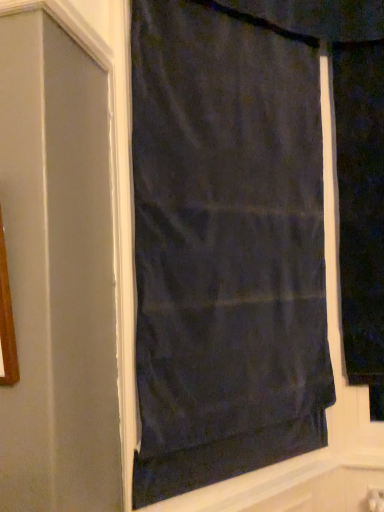
At what (x,y) coordinates should I click in order to perform the action: click on black fabric curtain at right, which is counted as the 1th curtain, starting from the right. Please return your answer as a coordinate pair (x, y). This screenshot has height=512, width=384. Looking at the image, I should click on (361, 210).

Describe the element at coordinates (361, 210) in the screenshot. I see `black fabric curtain at right, which is counted as the 1th curtain, starting from the right` at that location.

This screenshot has width=384, height=512. I want to click on dark matte fabric curtain at center, the 1th curtain positioned from the left, so click(x=225, y=246).

This screenshot has height=512, width=384. What do you see at coordinates (225, 246) in the screenshot?
I see `dark matte fabric curtain at center, the 2th curtain from the right` at bounding box center [225, 246].

Identify the location of black fabric curtain at right, which is counted as the 1th curtain, starting from the right. [x=361, y=210].

From the picture: Considering the relative positions of black fabric curtain at right, which is counted as the 1th curtain, starting from the right, and dark matte fabric curtain at center, the 1th curtain positioned from the left, in the image provided, is black fabric curtain at right, which is counted as the 1th curtain, starting from the right, to the left of dark matte fabric curtain at center, the 1th curtain positioned from the left, from the viewer's perspective?

No, black fabric curtain at right, which is counted as the 1th curtain, starting from the right, is not to the left of dark matte fabric curtain at center, the 1th curtain positioned from the left.

Relative to dark matte fabric curtain at center, the 1th curtain positioned from the left, is black fabric curtain at right, which is counted as the 1th curtain, starting from the right, in front or behind?

Visually, black fabric curtain at right, which is counted as the 1th curtain, starting from the right, is located behind dark matte fabric curtain at center, the 1th curtain positioned from the left.

Is point (370, 194) closer or farther from the camera than point (177, 47)?

Clearly, point (370, 194) is more distant from the camera than point (177, 47).

From the image's perspective, between black fabric curtain at right, which is counted as the 1th curtain, starting from the right, and dark matte fabric curtain at center, the 2th curtain from the right, which one is located above?

From the image's view, black fabric curtain at right, which is counted as the 1th curtain, starting from the right, is above.

From a real-world perspective, who is located higher, black fabric curtain at right, which is the second curtain in left-to-right order, or dark matte fabric curtain at center, the 2th curtain from the right?

black fabric curtain at right, which is the second curtain in left-to-right order, is physically above.

Between black fabric curtain at right, which is the second curtain in left-to-right order, and dark matte fabric curtain at center, the 2th curtain from the right, which one has smaller width?

dark matte fabric curtain at center, the 2th curtain from the right, is thinner.

Which of these two, black fabric curtain at right, which is counted as the 1th curtain, starting from the right, or dark matte fabric curtain at center, the 2th curtain from the right, stands taller?

dark matte fabric curtain at center, the 2th curtain from the right.

Between black fabric curtain at right, which is counted as the 1th curtain, starting from the right, and dark matte fabric curtain at center, the 2th curtain from the right, which one has smaller size?

black fabric curtain at right, which is counted as the 1th curtain, starting from the right, is smaller.

Is black fabric curtain at right, which is the second curtain in left-to-right order, not inside dark matte fabric curtain at center, the 2th curtain from the right?

Yes, black fabric curtain at right, which is the second curtain in left-to-right order, is not within dark matte fabric curtain at center, the 2th curtain from the right.

Does black fabric curtain at right, which is counted as the 1th curtain, starting from the right, touch dark matte fabric curtain at center, the 2th curtain from the right?

No, black fabric curtain at right, which is counted as the 1th curtain, starting from the right, is not in contact with dark matte fabric curtain at center, the 2th curtain from the right.

Is black fabric curtain at right, which is counted as the 1th curtain, starting from the right, looking in the opposite direction of dark matte fabric curtain at center, the 2th curtain from the right?

No, black fabric curtain at right, which is counted as the 1th curtain, starting from the right, is not facing the opposite direction of dark matte fabric curtain at center, the 2th curtain from the right.

Could you measure the distance between black fabric curtain at right, which is counted as the 1th curtain, starting from the right, and dark matte fabric curtain at center, the 2th curtain from the right?

black fabric curtain at right, which is counted as the 1th curtain, starting from the right, and dark matte fabric curtain at center, the 2th curtain from the right, are 52.41 centimeters apart.

At what (x,y) coordinates should I click in order to perform the action: click on curtain above the dark matte fabric curtain at center, the 1th curtain positioned from the left (from the image's perspective). Please return your answer as a coordinate pair (x, y). The width and height of the screenshot is (384, 512). Looking at the image, I should click on (361, 210).

Is dark matte fabric curtain at center, the 2th curtain from the right, at the right side of black fabric curtain at right, which is counted as the 1th curtain, starting from the right?

In fact, dark matte fabric curtain at center, the 2th curtain from the right, is to the left of black fabric curtain at right, which is counted as the 1th curtain, starting from the right.

Considering the positions of objects dark matte fabric curtain at center, the 1th curtain positioned from the left, and black fabric curtain at right, which is the second curtain in left-to-right order, in the image provided, who is behind, dark matte fabric curtain at center, the 1th curtain positioned from the left, or black fabric curtain at right, which is the second curtain in left-to-right order,?

Positioned behind is black fabric curtain at right, which is the second curtain in left-to-right order.

Considering the points (181, 333) and (348, 290), which point is behind, point (181, 333) or point (348, 290)?

The point (348, 290) is behind.

From the image's perspective, is dark matte fabric curtain at center, the 1th curtain positioned from the left, above black fabric curtain at right, which is the second curtain in left-to-right order?

No, from the image's perspective, dark matte fabric curtain at center, the 1th curtain positioned from the left, is not above black fabric curtain at right, which is the second curtain in left-to-right order.

From a real-world perspective, is dark matte fabric curtain at center, the 1th curtain positioned from the left, beneath black fabric curtain at right, which is counted as the 1th curtain, starting from the right?

Indeed, from a real-world perspective, dark matte fabric curtain at center, the 1th curtain positioned from the left, is positioned beneath black fabric curtain at right, which is counted as the 1th curtain, starting from the right.

Considering the sizes of objects dark matte fabric curtain at center, the 2th curtain from the right, and black fabric curtain at right, which is the second curtain in left-to-right order, in the image provided, who is thinner, dark matte fabric curtain at center, the 2th curtain from the right, or black fabric curtain at right, which is the second curtain in left-to-right order,?

Thinner between the two is dark matte fabric curtain at center, the 2th curtain from the right.

In terms of height, does dark matte fabric curtain at center, the 1th curtain positioned from the left, look taller or shorter compared to black fabric curtain at right, which is counted as the 1th curtain, starting from the right?

Clearly, dark matte fabric curtain at center, the 1th curtain positioned from the left, is taller compared to black fabric curtain at right, which is counted as the 1th curtain, starting from the right.

Is dark matte fabric curtain at center, the 1th curtain positioned from the left, smaller than black fabric curtain at right, which is counted as the 1th curtain, starting from the right?

Incorrect, dark matte fabric curtain at center, the 1th curtain positioned from the left, is not smaller in size than black fabric curtain at right, which is counted as the 1th curtain, starting from the right.

Choose the correct answer: Is dark matte fabric curtain at center, the 2th curtain from the right, inside black fabric curtain at right, which is counted as the 1th curtain, starting from the right, or outside it?

dark matte fabric curtain at center, the 2th curtain from the right, exists outside the volume of black fabric curtain at right, which is counted as the 1th curtain, starting from the right.

Does dark matte fabric curtain at center, the 2th curtain from the right, touch black fabric curtain at right, which is counted as the 1th curtain, starting from the right?

dark matte fabric curtain at center, the 2th curtain from the right, and black fabric curtain at right, which is counted as the 1th curtain, starting from the right, are not in contact.

Is dark matte fabric curtain at center, the 1th curtain positioned from the left, looking in the opposite direction of black fabric curtain at right, which is the second curtain in left-to-right order?

No.

At what (x,y) coordinates should I click in order to perform the action: click on curtain located behind the dark matte fabric curtain at center, the 1th curtain positioned from the left. Please return your answer as a coordinate pair (x, y). This screenshot has height=512, width=384. Looking at the image, I should click on (361, 210).

Locate an element on the screen. This screenshot has height=512, width=384. curtain located underneath the black fabric curtain at right, which is the second curtain in left-to-right order (from a real-world perspective) is located at coordinates (225, 246).

Where is `curtain that appears in front of the black fabric curtain at right, which is the second curtain in left-to-right order`? The width and height of the screenshot is (384, 512). curtain that appears in front of the black fabric curtain at right, which is the second curtain in left-to-right order is located at coordinates (225, 246).